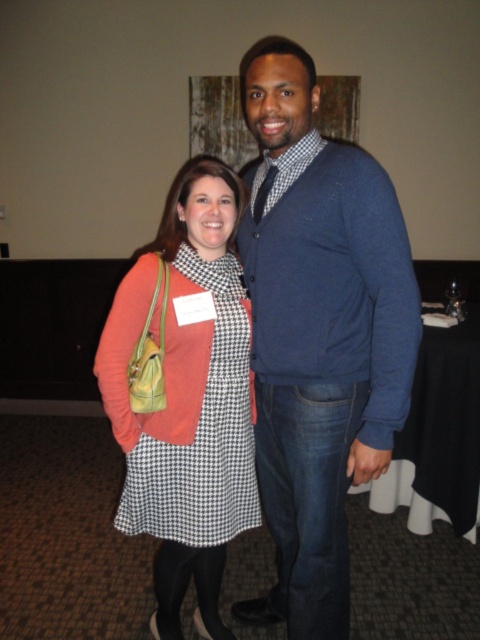
Between blue sweater at center and matte orange sweater at left, which one is positioned higher?

Positioned higher is blue sweater at center.

In the scene shown: Who is positioned more to the right, blue sweater at center or matte orange sweater at left?

blue sweater at center

Does point (382, 369) come closer to viewer compared to point (203, 440)?

Yes, point (382, 369) is in front of point (203, 440).

In order to click on blue sweater at center in this screenshot , I will do `click(319, 337)`.